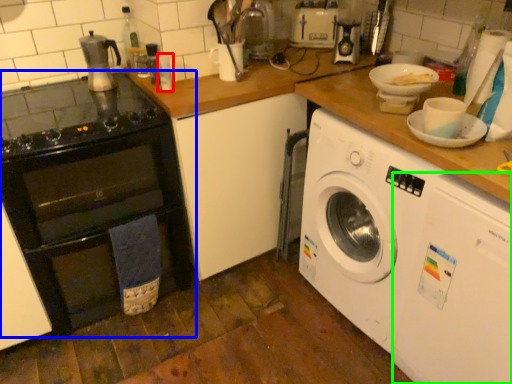
Question: Considering the real-world distances, which object is farthest from bottle (highlighted by a red box)? oven (highlighted by a blue box) or washing machine (highlighted by a green box)?

Choices:
 (A) oven
 (B) washing machine

Answer: (B)